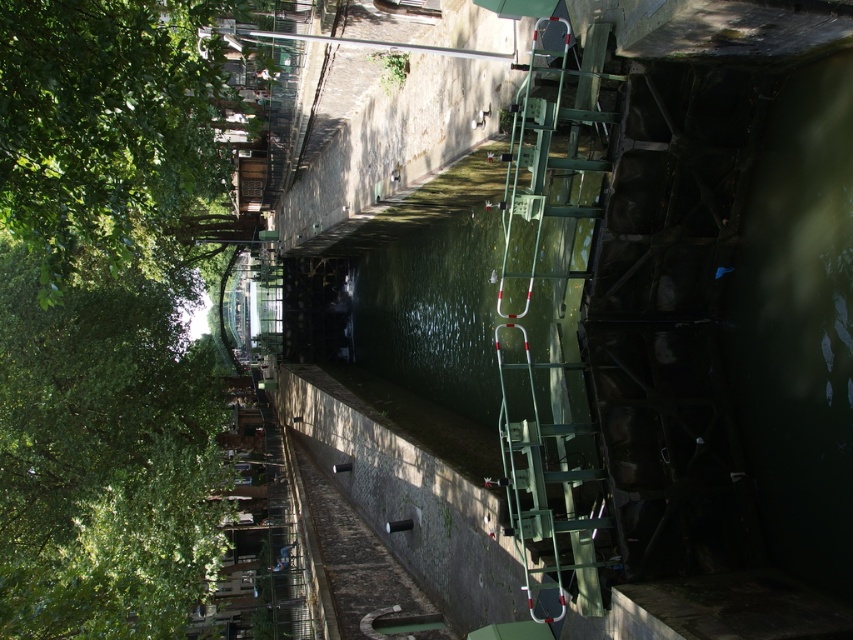
Does green leafy tree at left have a greater height compared to green leafy tree at upper left?

Indeed, green leafy tree at left has a greater height compared to green leafy tree at upper left.

Does point (166, 480) come in front of point (194, 134)?

That is True.

This screenshot has width=853, height=640. I want to click on green leafy tree at left, so click(103, 458).

Which of these two, green leafy tree at left or green metallic ladder at right, stands shorter?

green metallic ladder at right

Is green leafy tree at left above green metallic ladder at right?

Incorrect, green leafy tree at left is not positioned above green metallic ladder at right.

Which is behind, point (38, 396) or point (601, 45)?

The point (38, 396) is more distant.

Where is `green leafy tree at left`? This screenshot has width=853, height=640. green leafy tree at left is located at coordinates (103, 458).

Which is in front, point (138, 20) or point (583, 72)?

Point (583, 72)

Can you confirm if green leafy tree at upper left is thinner than green metallic ladder at right?

No.

Is point (136, 164) positioned in front of point (585, 589)?

No, (136, 164) is further to viewer.

At what (x,y) coordinates should I click in order to perform the action: click on green leafy tree at upper left. Please return your answer as a coordinate pair (x, y). This screenshot has width=853, height=640. Looking at the image, I should click on (107, 124).